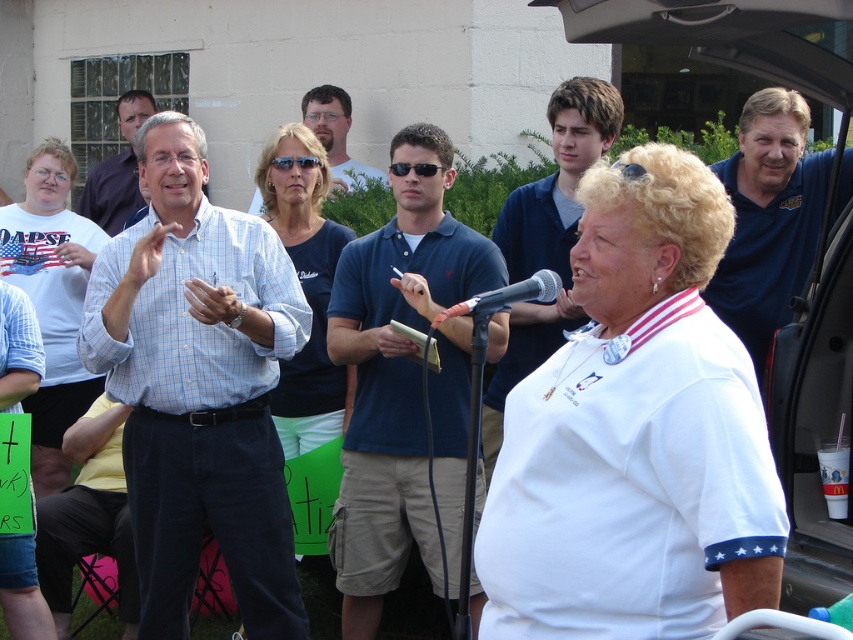
Question: Does matte blue shirt at center lie behind black plastic microphone at center?

Choices:
 (A) yes
 (B) no

Answer: (A)

Question: Which object is the closest to the matte blue shirt at center?

Choices:
 (A) light blue shirt at center
 (B) light blue plaid shirt at center
 (C) blue shirt at center
 (D) dark blue polo shirt at center

Answer: (A)

Question: Can you confirm if light blue shirt at center is positioned below black plastic microphone at center?

Choices:
 (A) no
 (B) yes

Answer: (A)

Question: Which point appears farthest from the camera in this image?

Choices:
 (A) (358, 472)
 (B) (442, 317)
 (C) (337, 163)

Answer: (C)

Question: Can you confirm if matte blue shirt at center is positioned to the right of black plastic microphone at center?

Choices:
 (A) no
 (B) yes

Answer: (A)

Question: Among these objects, which one is nearest to the camera?

Choices:
 (A) yellow shirt at lower left
 (B) matte blue shirt at center
 (C) black plastic microphone at center
 (D) dark blue polo shirt at center

Answer: (C)